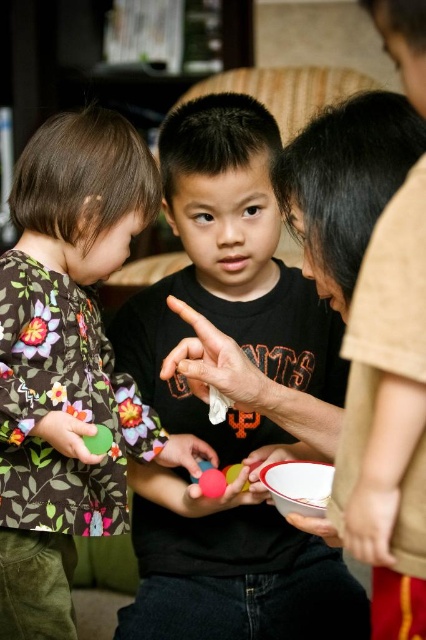
Question: Is black matte shirt at center positioned in front of smooth rubber ball at center?

Choices:
 (A) no
 (B) yes

Answer: (B)

Question: Which point is farther from the camera taking this photo?

Choices:
 (A) (328, 528)
 (B) (210, 472)
 (C) (175, 312)

Answer: (C)

Question: Can you confirm if rubber matte ball at center is positioned to the left of green matte ball at lower left?

Choices:
 (A) no
 (B) yes

Answer: (A)

Question: Is white matte hand at center bigger than white glossy bowl at center?

Choices:
 (A) yes
 (B) no

Answer: (A)

Question: Which point is farther to the camera?

Choices:
 (A) floral fabric shirt at left
 (B) black matte shirt at center
 (C) white matte hand at center
 (D) rubber matte ball at center

Answer: (B)

Question: Which of the following is the closest to the observer?

Choices:
 (A) (180, 449)
 (B) (210, 480)
 (C) (184, 221)

Answer: (B)